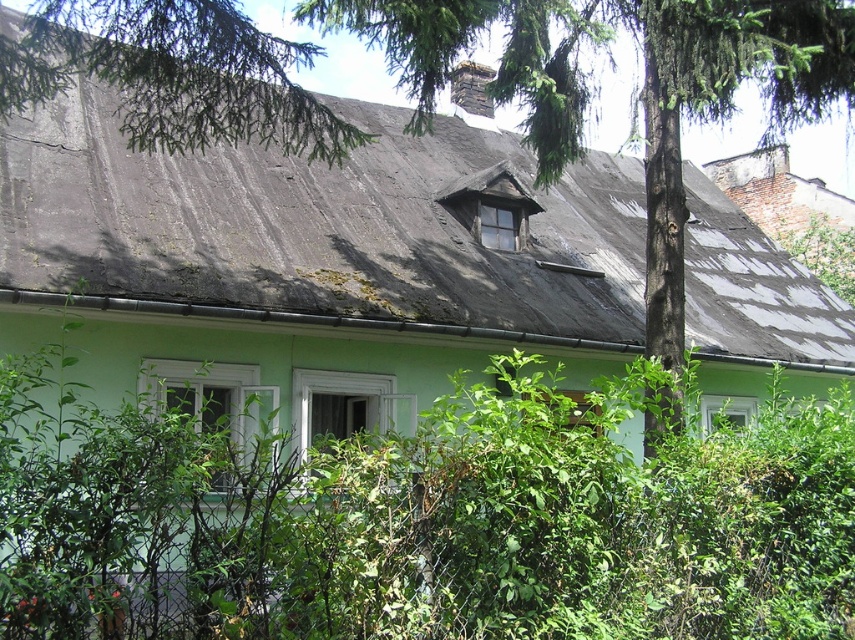
You are a landscape architect designing a garden around the house. You need to know which area has more space to accommodate larger plants. Based on the image, which object takes up less space, the green leafy bush at center or the gray shingles at upper center?

The green leafy bush at center occupies less space than the gray shingles at upper center, so the gray shingles at upper center has more space available for larger plants.

You are standing in front of the house and want to trim the green leafy bush at center. To avoid damaging the gray shingles at upper center, in which direction should you move the bush?

The green leafy bush at center is to the left of the gray shingles at upper center, so you should move it to the right to avoid damaging the shingles.